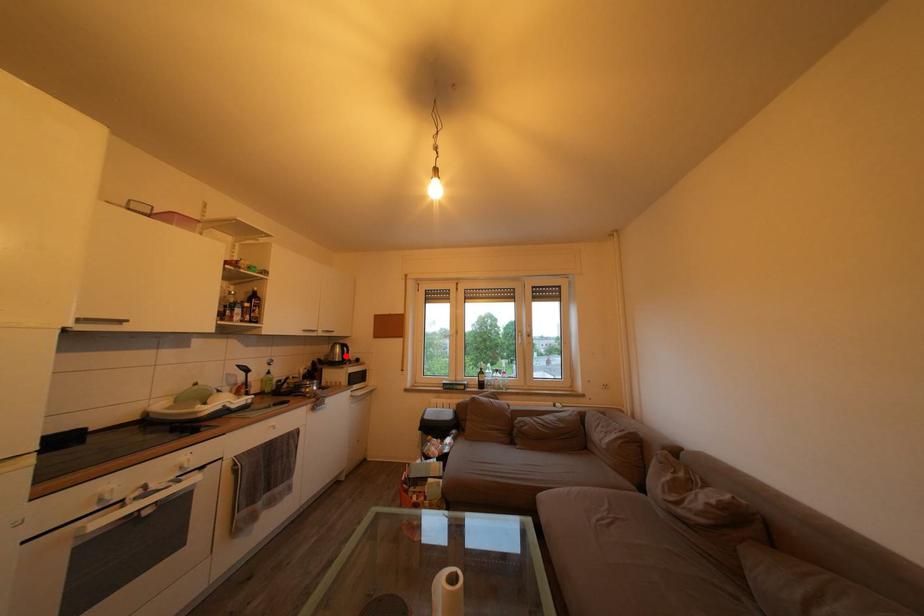
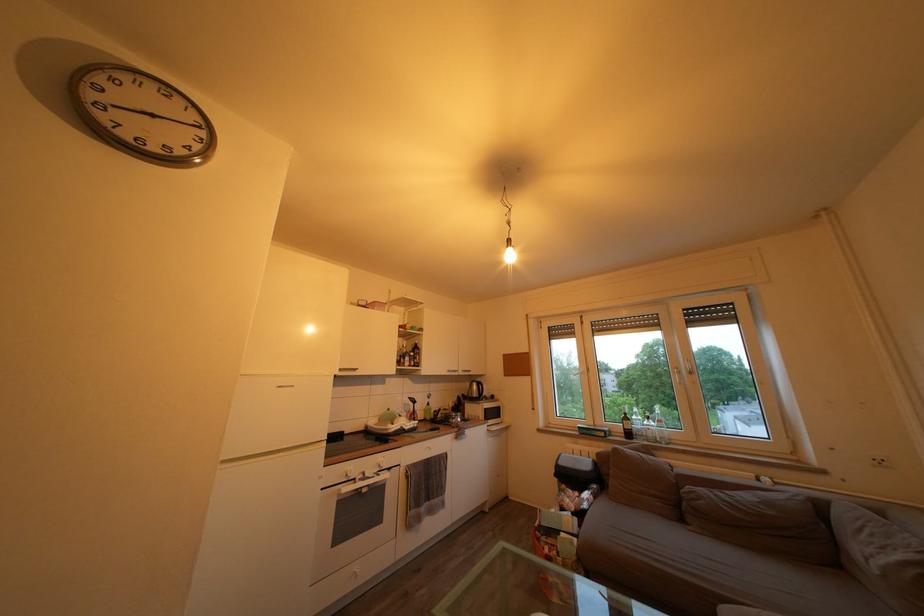
Find the pixel in the second image that matches the highlighted location in the first image.

(482, 392)